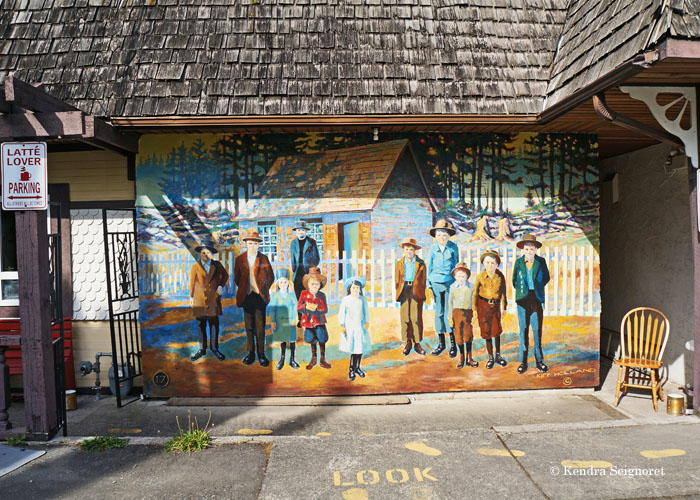
I want to click on painting, so click(x=388, y=245).